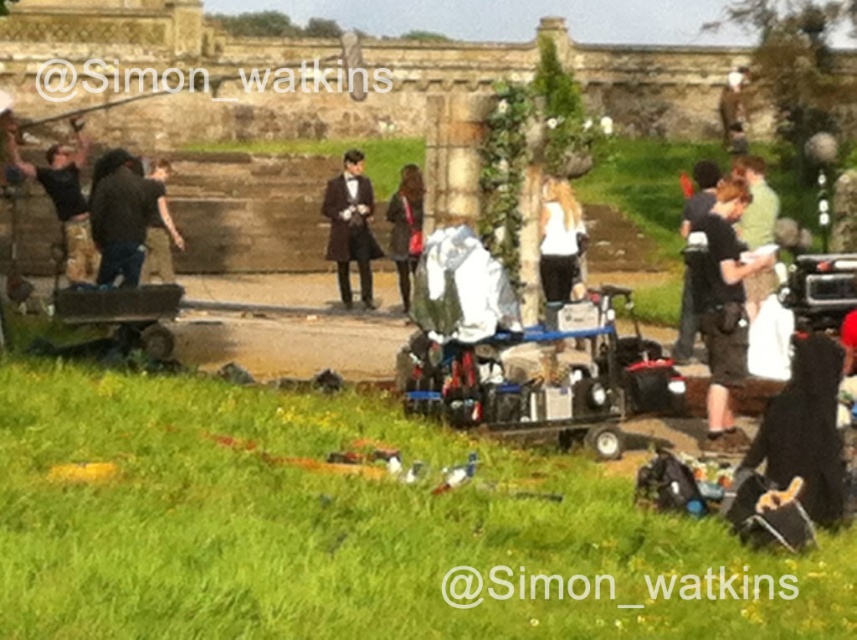
Can you confirm if black cotton shirt at right is positioned below dark gray fabric at center?

Correct, black cotton shirt at right is located below dark gray fabric at center.

Does point (693, 275) lie in front of point (105, 220)?

Yes, it is.

This screenshot has width=857, height=640. I want to click on black cotton shirt at right, so click(723, 307).

The height and width of the screenshot is (640, 857). What do you see at coordinates (349, 529) in the screenshot? I see `green grass at lower center` at bounding box center [349, 529].

Is point (562, 616) closer to viewer compared to point (49, 177)?

Yes, it is.

Is point (223, 550) closer to viewer compared to point (70, 237)?

Yes.

Where is `green grass at lower center`? Image resolution: width=857 pixels, height=640 pixels. green grass at lower center is located at coordinates (349, 529).

Consider the image. Can you confirm if black cotton shirt at right is taller than matte brown coat at center?

No.

In the scene shown: Who is taller, black cotton shirt at right or matte brown coat at center?

Standing taller between the two is matte brown coat at center.

This screenshot has width=857, height=640. I want to click on black cotton shirt at right, so click(x=723, y=307).

At what (x,y) coordinates should I click in order to perform the action: click on black cotton shirt at right. Please return your answer as a coordinate pair (x, y). Image resolution: width=857 pixels, height=640 pixels. Looking at the image, I should click on tap(723, 307).